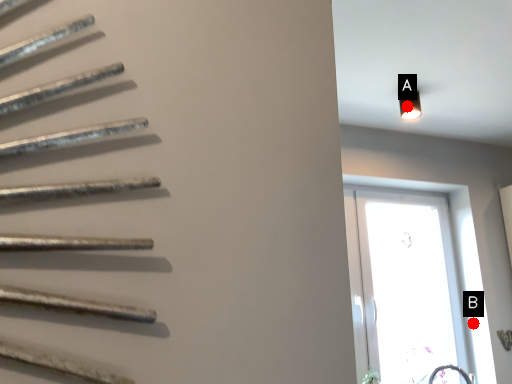
Question: Two points are circled on the image, labeled by A and B beside each circle. Which point is closer to the camera?

Choices:
 (A) A is closer
 (B) B is closer

Answer: (A)